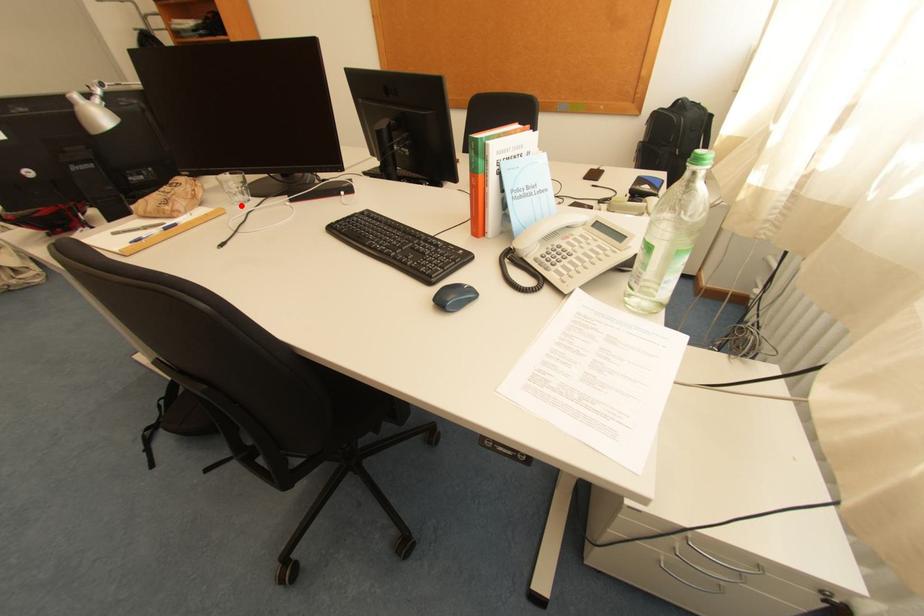
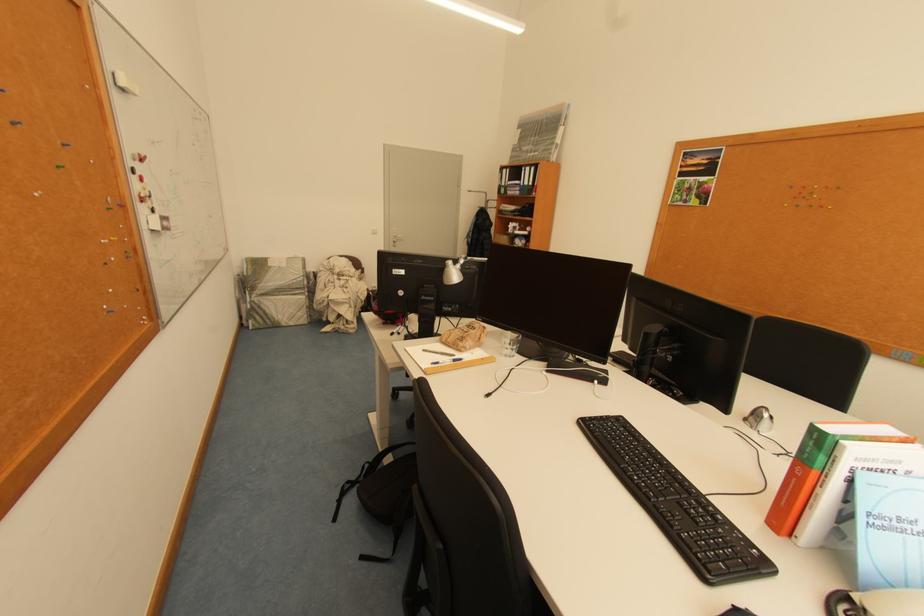
In the second image, find the point that corresponds to the highlighted location in the first image.

(508, 355)